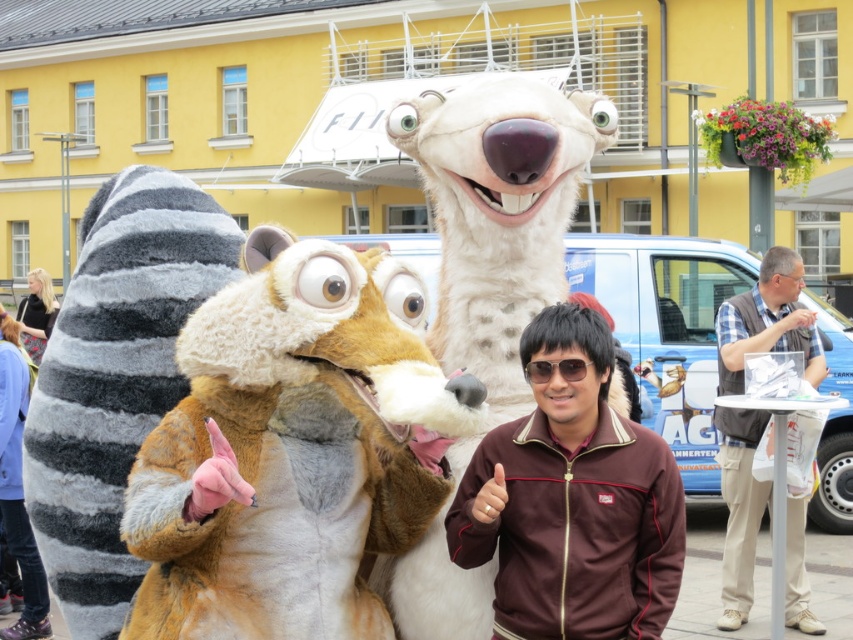
You are a photographer trying to capture a clear photo of both the fuzzy brown fox at center and the sunglasses at center. Since the camera can only focus on one object at a time, which object should you choose to ensure the other fits in the frame?

The fuzzy brown fox at center is wider than the sunglasses at center, so you should focus on the fuzzy brown fox at center to ensure the sunglasses at center also fits in the frame.

You are a photographer trying to capture a group photo of the white plush bear at center and the beige fabric vest at right. To ensure both are in frame, should you adjust your camera to focus on the left or the right side more?

The white plush bear at center is to the left of the beige fabric vest at right, so you should focus more on the left side to include both in the frame.